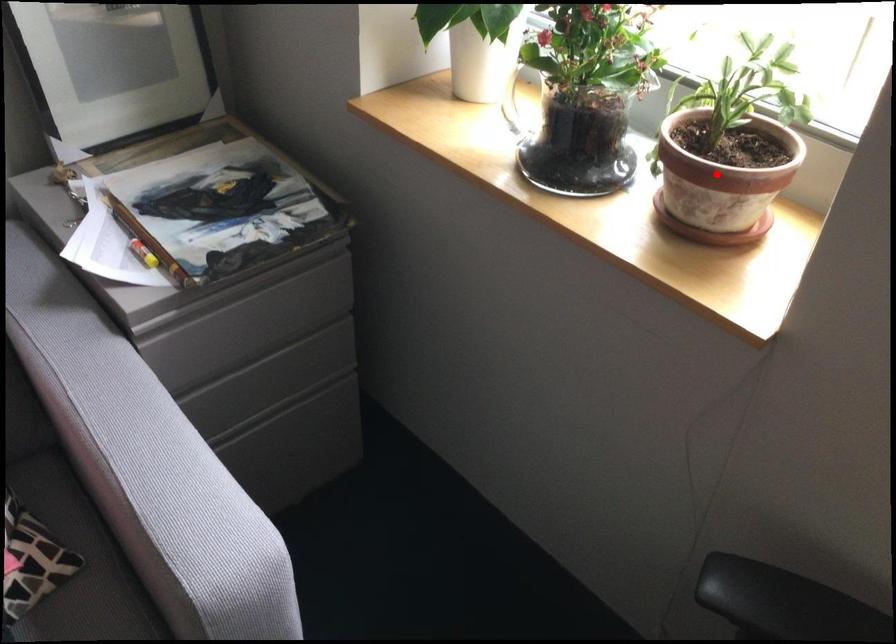
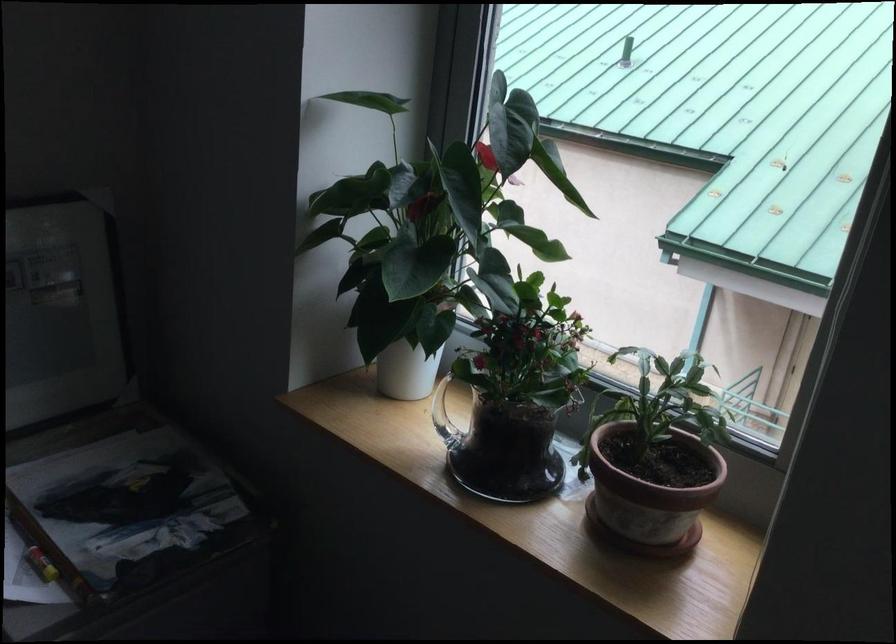
Locate, in the second image, the point that corresponds to the highlighted location in the first image.

(650, 493)